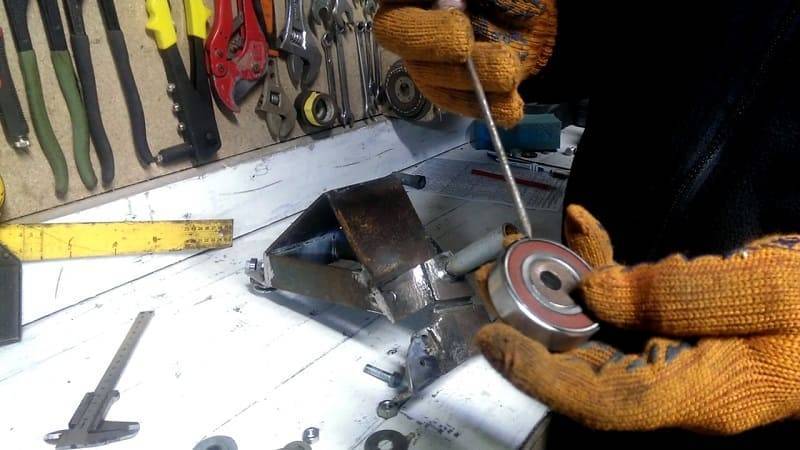
You are a GUI agent. You are given a task and a screenshot of the screen. Output one action in this format:
    pyautogui.click(x=<x>, y=<y>)
    Task: Click on the yellow ruler
    The height and width of the screenshot is (450, 800).
    Given the screenshot: What is the action you would take?
    pyautogui.click(x=70, y=245)